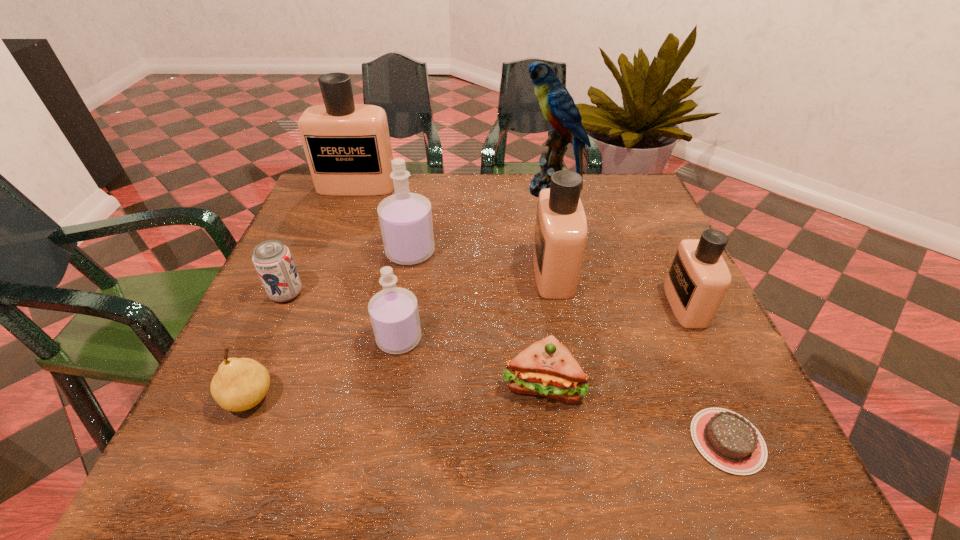
Locate an element on the screen. The width and height of the screenshot is (960, 540). free space between the rightmost perfume and the tallest perfume is located at coordinates (521, 246).

This screenshot has width=960, height=540. I want to click on vacant space that's between the pear and the brown chocolate cake, so click(x=489, y=419).

Find the location of a particular element. Image resolution: width=960 pixels, height=540 pixels. free spot between the pear and the beer can is located at coordinates (268, 346).

At what (x,y) coordinates should I click in order to perform the action: click on vacant area that lies between the parrot and the nearer purple perfume. Please return your answer as a coordinate pair (x, y). This screenshot has height=540, width=960. Looking at the image, I should click on (474, 264).

Identify the location of free space that is in between the sandwich and the leftmost beige perfume. Image resolution: width=960 pixels, height=540 pixels. (450, 285).

The width and height of the screenshot is (960, 540). Identify the location of free space between the parrot and the smaller purple perfume. (474, 264).

Image resolution: width=960 pixels, height=540 pixels. In order to click on vacant space in between the second beige perfume from right to left and the chocolate cake in this screenshot , I will do `click(640, 356)`.

Identify which object is the sixth nearest to the sandwich. Please provide its 2D coordinates. Your answer should be formatted as a tuple, i.e. [(x, y)], where the tuple contains the x and y coordinates of a point satisfying the conditions above.

[(240, 384)]

I want to click on the fifth closest object to the second beige perfume from right to left, so click(x=393, y=311).

Choose which perfume is the fourth nearest neighbor to the pear. Please provide its 2D coordinates. Your answer should be formatted as a tuple, i.e. [(x, y)], where the tuple contains the x and y coordinates of a point satisfying the conditions above.

[(347, 146)]